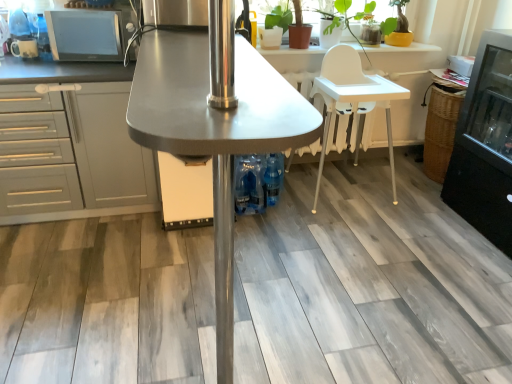
Question: Is there a large distance between matte brown pot at upper right and gray matte cabinet at left?

Choices:
 (A) no
 (B) yes

Answer: (B)

Question: Does matte brown pot at upper right have a greater height compared to gray matte cabinet at left?

Choices:
 (A) no
 (B) yes

Answer: (A)

Question: Is matte brown pot at upper right smaller than gray matte cabinet at left?

Choices:
 (A) no
 (B) yes

Answer: (B)

Question: Is matte brown pot at upper right positioned in front of gray matte cabinet at left?

Choices:
 (A) yes
 (B) no

Answer: (B)

Question: Is matte brown pot at upper right wider than gray matte cabinet at left?

Choices:
 (A) no
 (B) yes

Answer: (A)

Question: Is matte black microwave at upper left, which is counted as the first appliance, starting from the right, wider or thinner than white plastic chair at center?

Choices:
 (A) thin
 (B) wide

Answer: (A)

Question: Considering the positions of matte black microwave at upper left, which ranks as the 2th appliance in left-to-right order, and white plastic chair at center in the image, is matte black microwave at upper left, which ranks as the 2th appliance in left-to-right order, taller or shorter than white plastic chair at center?

Choices:
 (A) tall
 (B) short

Answer: (B)

Question: Is matte black microwave at upper left, which is counted as the first appliance, starting from the right, bigger or smaller than white plastic chair at center?

Choices:
 (A) small
 (B) big

Answer: (A)

Question: Is matte black microwave at upper left, which ranks as the 2th appliance in left-to-right order, in front of or behind white plastic chair at center in the image?

Choices:
 (A) behind
 (B) front

Answer: (B)

Question: Is white plastic high chair at center, which ranks as the 2th table in left-to-right order, wider or thinner than matte black microwave at upper left, which ranks as the 2th appliance in left-to-right order?

Choices:
 (A) wide
 (B) thin

Answer: (B)

Question: Considering the relative positions of white plastic high chair at center, positioned as the first table in back-to-front order, and matte black microwave at upper left, which ranks as the 2th appliance in left-to-right order, in the image provided, is white plastic high chair at center, positioned as the first table in back-to-front order, to the left or to the right of matte black microwave at upper left, which ranks as the 2th appliance in left-to-right order,?

Choices:
 (A) left
 (B) right

Answer: (B)

Question: Is point (282, 49) closer or farther from the camera than point (117, 16)?

Choices:
 (A) closer
 (B) farther

Answer: (B)

Question: In terms of height, does white plastic high chair at center, positioned as the first table in back-to-front order, look taller or shorter compared to matte black microwave at upper left, which is counted as the first appliance, starting from the right?

Choices:
 (A) tall
 (B) short

Answer: (A)

Question: In terms of width, does metallic gray table at center, arranged as the 1th table when viewed from the left, look wider or thinner when compared to gray matte cabinet at left?

Choices:
 (A) wide
 (B) thin

Answer: (B)

Question: Is metallic gray table at center, which ranks as the second table in back-to-front order, situated inside gray matte cabinet at left or outside?

Choices:
 (A) inside
 (B) outside

Answer: (B)